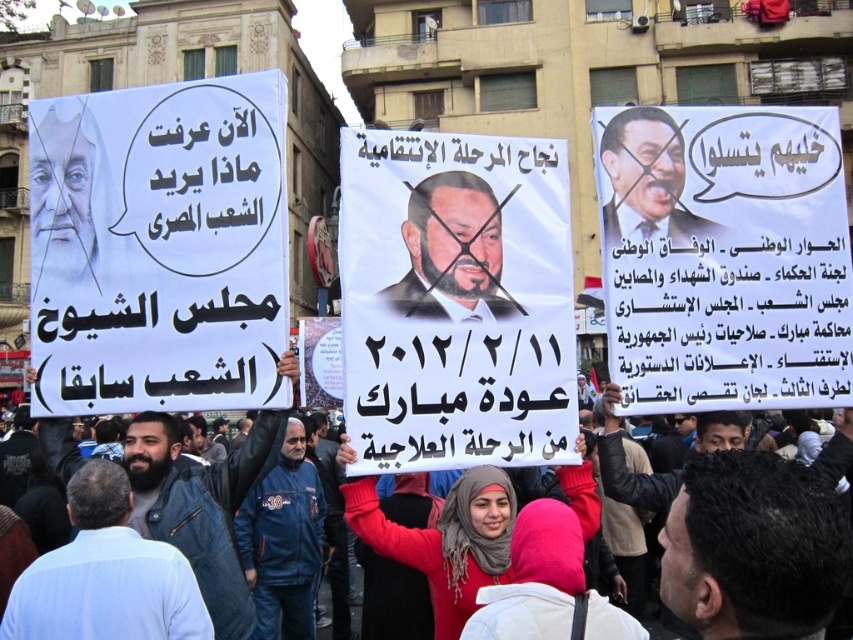
You are a photographer standing at the edge of the protest scene. You want to capture a photo that includes both the denim jacket at lower left and the denim jacket at center. Given that your camera has a maximum focus range of 9 feet, will you be able to fit both jackets in the frame without moving closer?

The denim jacket at lower left is 8.96 feet from the denim jacket at center, which is within the camera maximum focus range of 9 feet. Therefore, both jackets can be captured in the frame without moving closer.

You are a photographer trying to capture the most prominent sign in the scene. You have a camera with a limited zoom range. The matte black poster at upper right and the white paper sign at center are both in your view. Which sign should you focus on to ensure it fills the frame better without zooming?

The white paper sign at center is taller than the matte black poster at upper right, so focusing on the white paper sign at center will allow it to fill the frame better without needing to zoom in further.

You are a photographer trying to capture a clear shot of both the white paper poster at left and the denim jacket at center. Based on their positions and sizes, which object should you prioritize framing first to ensure it fits in your camera viewfinder?

The white paper poster at left might be wider than the denim jacket at center, so you should prioritize framing the white paper poster at left first to ensure it fits in your camera viewfinder.